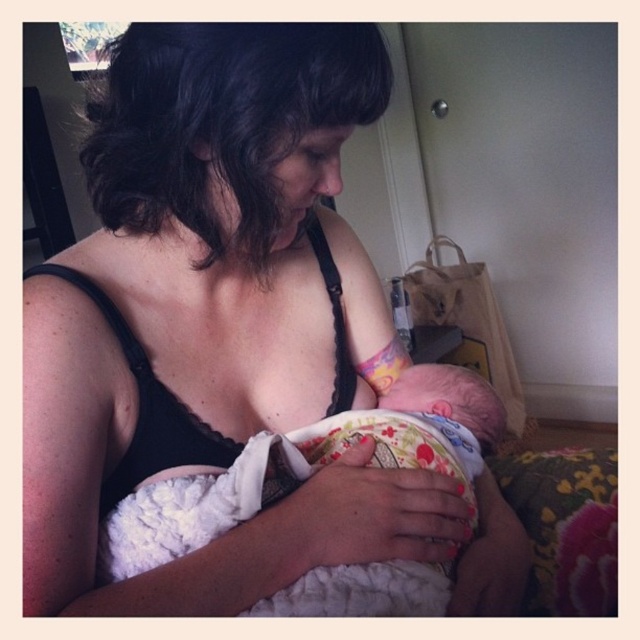
You are a photographer standing at the point marked as point (500, 589). You want to take a photo of the woman and her baby from a distance of 25 inches. Can you confirm if you are at the correct position?

The point (500, 589) is 24.80 inches away from the camera, so yes, you are at the correct position to take the photo from 25 inches away.

You are a photographer taking a picture of the black lace tank top at center and the fluffy white blanket at center. Which object should you focus on first if you want to capture both in the same frame without moving the camera?

The black lace tank top at center is taller than the fluffy white blanket at center, so you should focus on the black lace tank top at center first to ensure both are in the frame.

You are a photographer setting up a shoot in this scene. You need to place a small lamp between the black lace tank top at center and the fluffy white blanket at center. Which object should the lamp be closer to if it must be placed exactly halfway between them?

The lamp should be placed exactly halfway between the black lace tank top at center and the fluffy white blanket at center. Since the black lace tank top at center is bigger than the fluffy white blanket at center, the lamp will naturally be closer to the smaller object, which is the fluffy white blanket at center, to maintain equal distance from both objects.